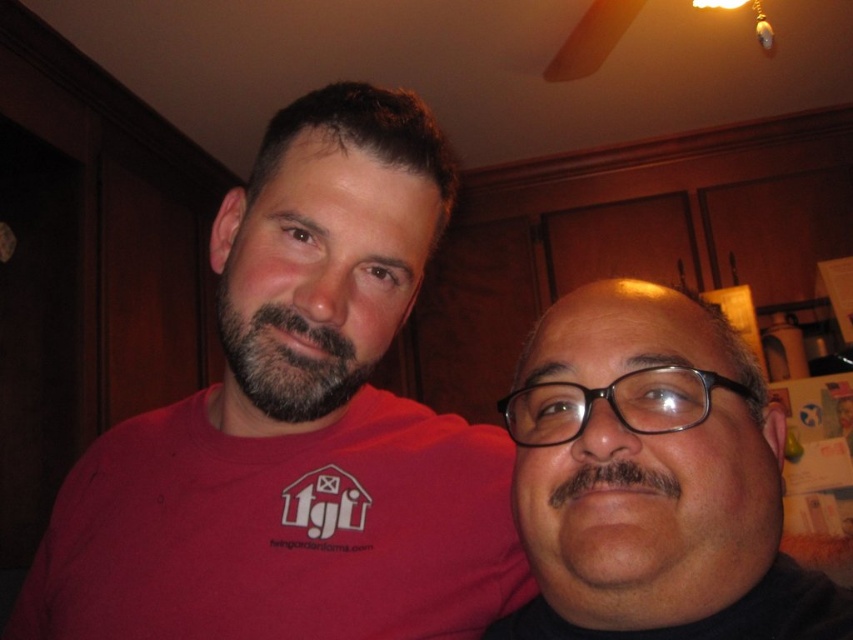
Question: Estimate the real-world distances between objects in this image. Which object is closer to the matte red t-shirt at center?

Choices:
 (A) dark brown fuzzy beard at center
 (B) black matte glasses at center

Answer: (A)

Question: Which object is positioned closest to the dark brown fuzzy beard at center?

Choices:
 (A) black matte glasses at center
 (B) matte red t-shirt at center

Answer: (B)

Question: Observing the image, what is the correct spatial positioning of black matte glasses at center in reference to dark brown fuzzy beard at center?

Choices:
 (A) right
 (B) left

Answer: (A)

Question: Which point appears closest to the camera in this image?

Choices:
 (A) (778, 490)
 (B) (285, 308)
 (C) (186, 502)

Answer: (A)

Question: Is matte red t-shirt at center wider than dark brown fuzzy beard at center?

Choices:
 (A) yes
 (B) no

Answer: (A)

Question: Does matte red t-shirt at center have a lesser width compared to black matte glasses at center?

Choices:
 (A) no
 (B) yes

Answer: (A)